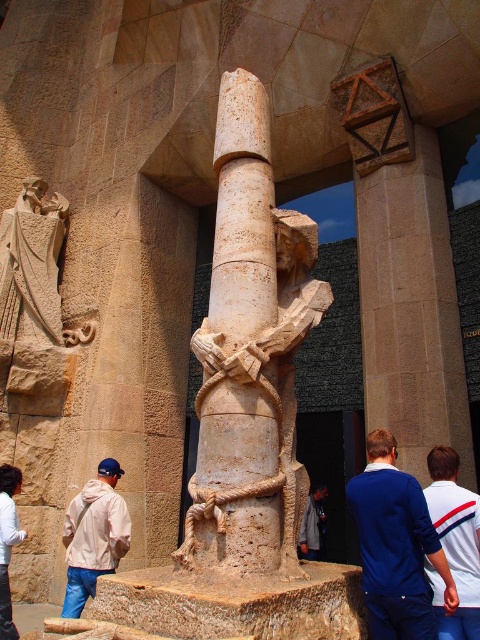
Is white jersey at center bigger than dark gray fabric at center?

No.

Does white jersey at center appear under dark gray fabric at center?

Actually, white jersey at center is above dark gray fabric at center.

Between point (470, 620) and point (308, 509), which one is positioned behind?

The point (308, 509) is behind.

I want to click on white jersey at center, so click(454, 544).

Does point (273, 378) come closer to viewer compared to point (4, 602)?

Yes.

Who is positioned more to the right, beige stone column at center or white cotton shirt at lower left?

beige stone column at center is more to the right.

Is point (225, 368) farther from viewer compared to point (1, 502)?

No, (225, 368) is in front of (1, 502).

I want to click on beige stone column at center, so click(x=251, y=353).

Between white cotton shirt at lower left and dark gray fabric at center, which one has less height?

white cotton shirt at lower left is shorter.

Between white cotton shirt at lower left and dark gray fabric at center, which one has more height?

With more height is dark gray fabric at center.

Where is `white cotton shirt at lower left`? The height and width of the screenshot is (640, 480). white cotton shirt at lower left is located at coordinates (8, 544).